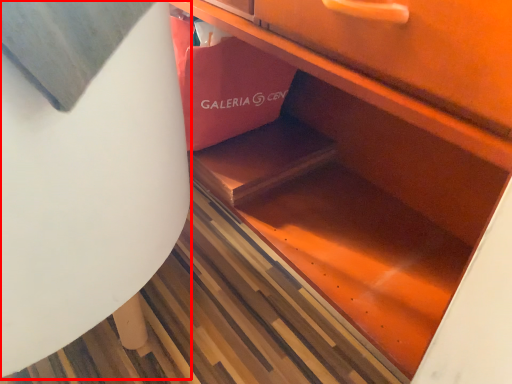
Question: From the image's perspective, considering the relative positions of round table (annotated by the red box) and shopping bag in the image provided, where is round table (annotated by the red box) located with respect to the staircase?

Choices:
 (A) below
 (B) above

Answer: (A)